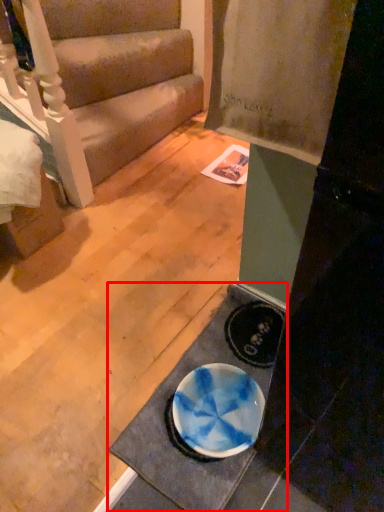
Question: From the image, what is the correct spatial relationship of doormat (annotated by the red box) in relation to studio couch?

Choices:
 (A) left
 (B) right

Answer: (B)